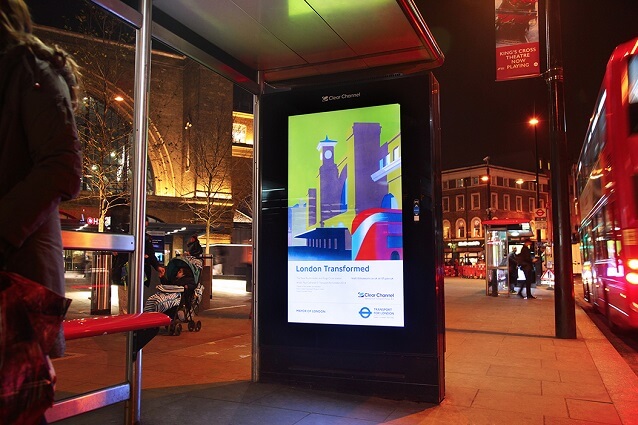
Find the location of a particular element. light reflections is located at coordinates (271, 30), (295, 7).